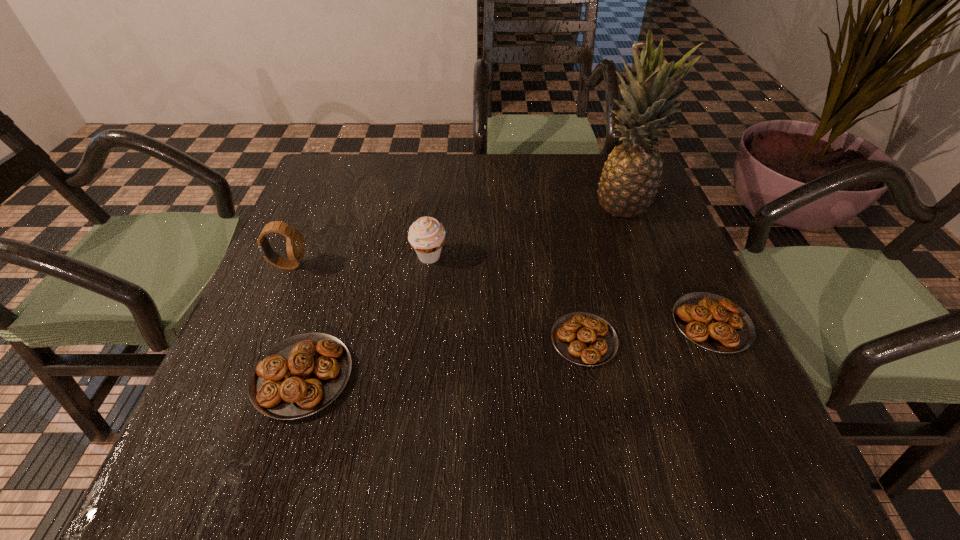
The height and width of the screenshot is (540, 960). In order to click on vacant space positioned on the back of the shortest object in this screenshot , I will do `click(555, 195)`.

Image resolution: width=960 pixels, height=540 pixels. I want to click on free space located on the back of the fifth tallest object, so click(x=654, y=198).

At what (x,y) coordinates should I click in order to perform the action: click on vacant space located on the back of the farthest object. Please return your answer as a coordinate pair (x, y). The width and height of the screenshot is (960, 540). Looking at the image, I should click on (609, 168).

The image size is (960, 540). Identify the location of vacant space positioned 0.360m on the face of the watch. (469, 265).

Find the location of `vacant space located on the right of the fourth object from right to left`. vacant space located on the right of the fourth object from right to left is located at coordinates (550, 257).

Image resolution: width=960 pixels, height=540 pixels. Find the location of `object at the far edge`. object at the far edge is located at coordinates (629, 182).

Where is `object located in the near edge section of the desktop`? object located in the near edge section of the desktop is located at coordinates (299, 376).

Identify the location of pastry that is at the left edge. (299, 376).

Identify the location of watch at the left edge. (295, 246).

You are a GUI agent. You are given a task and a screenshot of the screen. Output one action in this format:
    pyautogui.click(x=<x>, y=<y>)
    Task: Click on the pastry that is at the right edge
    This screenshot has width=960, height=540.
    Given the screenshot: What is the action you would take?
    pyautogui.click(x=713, y=322)